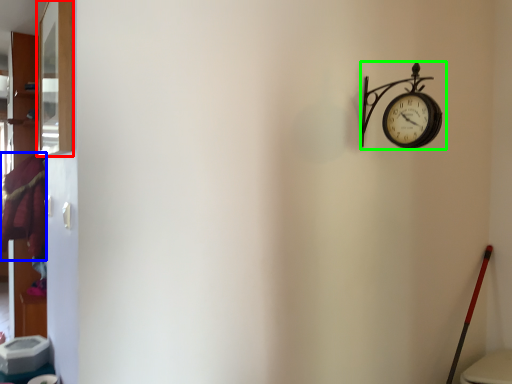
Question: Based on their relative distances, which object is nearer to window (highlighted by a red box)? Choose from laundry (highlighted by a blue box) and wall clock (highlighted by a green box).

Choices:
 (A) laundry
 (B) wall clock

Answer: (B)